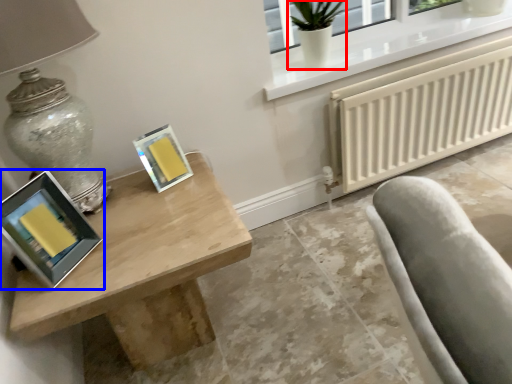
Question: Which of the following is the farthest to the observer, glass vase (highlighted by a red box) or picture frame (highlighted by a blue box)?

Choices:
 (A) glass vase
 (B) picture frame

Answer: (A)